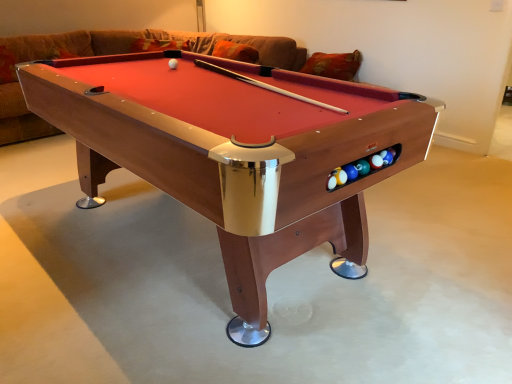
Question: From a real-world perspective, is wooden billiard table at center over brown fabric couch at upper center?

Choices:
 (A) no
 (B) yes

Answer: (B)

Question: Can you confirm if wooden billiard table at center is thinner than brown fabric couch at upper center?

Choices:
 (A) no
 (B) yes

Answer: (B)

Question: Is wooden billiard table at center closer to the viewer compared to brown fabric couch at upper center?

Choices:
 (A) yes
 (B) no

Answer: (A)

Question: Considering the relative sizes of wooden billiard table at center and brown fabric couch at upper center in the image provided, is wooden billiard table at center taller than brown fabric couch at upper center?

Choices:
 (A) yes
 (B) no

Answer: (A)

Question: Is wooden billiard table at center in contact with brown fabric couch at upper center?

Choices:
 (A) no
 (B) yes

Answer: (A)

Question: From the image's perspective, relative to wooden billiard table at center, is white matte ball at center above or below?

Choices:
 (A) above
 (B) below

Answer: (A)

Question: Looking at the image, does white matte ball at center seem bigger or smaller compared to wooden billiard table at center?

Choices:
 (A) small
 (B) big

Answer: (A)

Question: Is point (175, 64) positioned closer to the camera than point (282, 115)?

Choices:
 (A) closer
 (B) farther

Answer: (B)

Question: From their relative heights in the image, would you say white matte ball at center is taller or shorter than wooden billiard table at center?

Choices:
 (A) short
 (B) tall

Answer: (A)

Question: Is brown fabric couch at upper center bigger or smaller than white matte ball at center?

Choices:
 (A) big
 (B) small

Answer: (A)

Question: Is point tap(287, 67) positioned closer to the camera than point tap(173, 62)?

Choices:
 (A) farther
 (B) closer

Answer: (A)

Question: Considering their positions, is brown fabric couch at upper center located in front of or behind white matte ball at center?

Choices:
 (A) behind
 (B) front

Answer: (A)

Question: Is brown fabric couch at upper center to the left or to the right of white matte ball at center in the image?

Choices:
 (A) right
 (B) left

Answer: (B)

Question: From a real-world perspective, is wooden billiard table at center physically located above or below white matte ball at center?

Choices:
 (A) above
 (B) below

Answer: (B)

Question: From the image's perspective, is wooden billiard table at center positioned above or below white matte ball at center?

Choices:
 (A) above
 (B) below

Answer: (B)